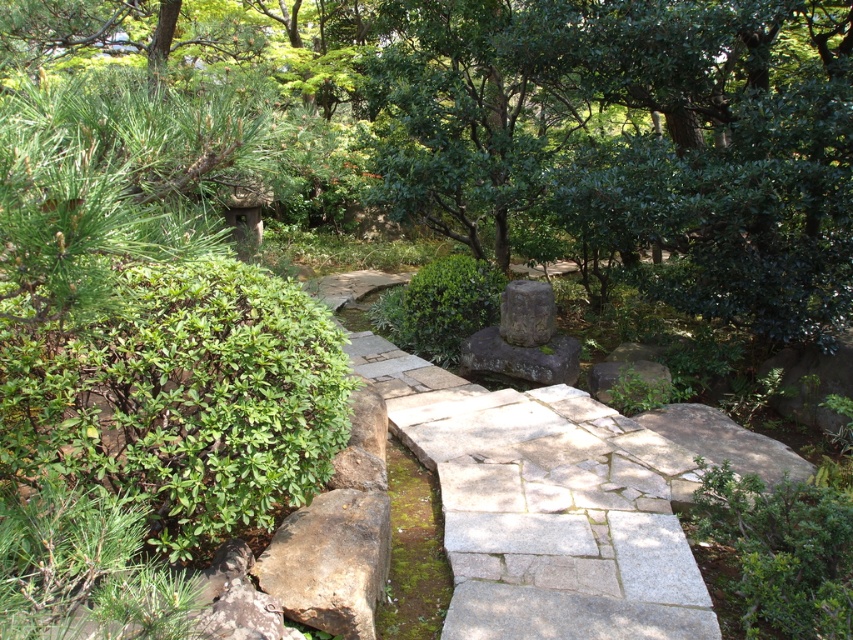
Which of these two, green leafy bush at center or gray stone at center, stands taller?

green leafy bush at center is taller.

Measure the distance between point (418, 292) and camera.

Point (418, 292) and camera are 5.99 meters apart.

You are a GUI agent. You are given a task and a screenshot of the screen. Output one action in this format:
    pyautogui.click(x=<x>, y=<y>)
    Task: Click on the green leafy bush at center
    The image size is (853, 640).
    Given the screenshot: What is the action you would take?
    pyautogui.click(x=440, y=307)

Which is in front, point (323, 387) or point (808, 486)?

Point (323, 387)

Is green leafy bush at left shorter than green leafy bush at lower right?

Incorrect, green leafy bush at left's height does not fall short of green leafy bush at lower right's.

Identify the location of green leafy bush at left. (181, 397).

The width and height of the screenshot is (853, 640). Identify the location of green leafy bush at left. tap(181, 397).

Does green leafy bush at lower right lie in front of green leafy bush at center?

Yes, it is.

This screenshot has height=640, width=853. What do you see at coordinates (778, 552) in the screenshot?
I see `green leafy bush at lower right` at bounding box center [778, 552].

Where is `green leafy bush at lower right`? The width and height of the screenshot is (853, 640). green leafy bush at lower right is located at coordinates (778, 552).